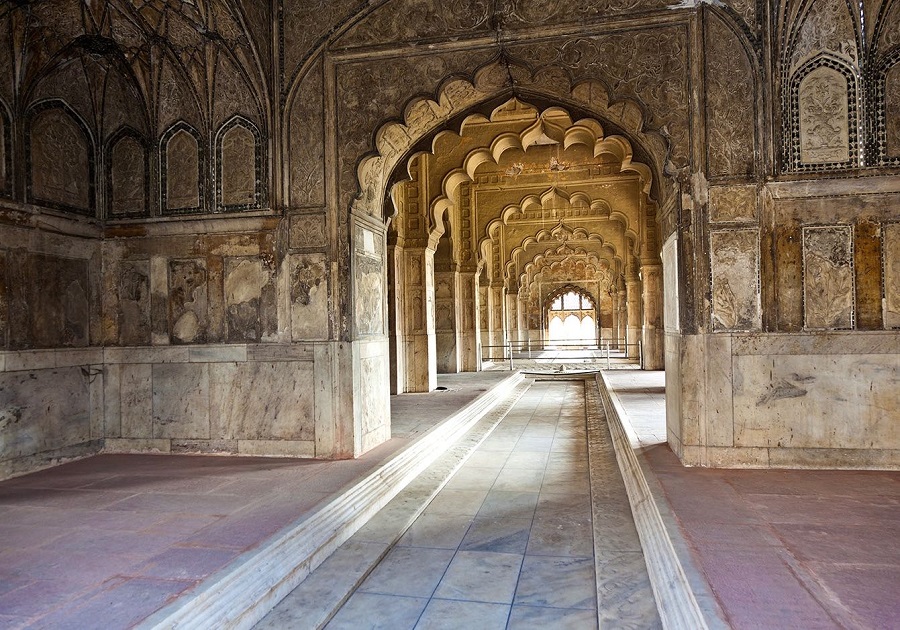
I want to click on decorative plaques, so click(817, 140), click(271, 155), click(174, 168), click(122, 185), click(50, 150).